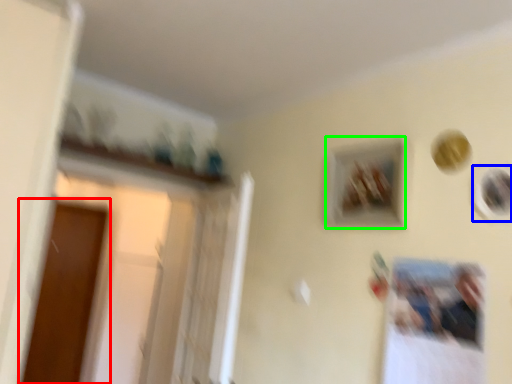
Question: Which object is positioned closest to screen door (highlighted by a red box)? Select from picture frame (highlighted by a blue box) and picture frame (highlighted by a green box).

Choices:
 (A) picture frame
 (B) picture frame

Answer: (B)